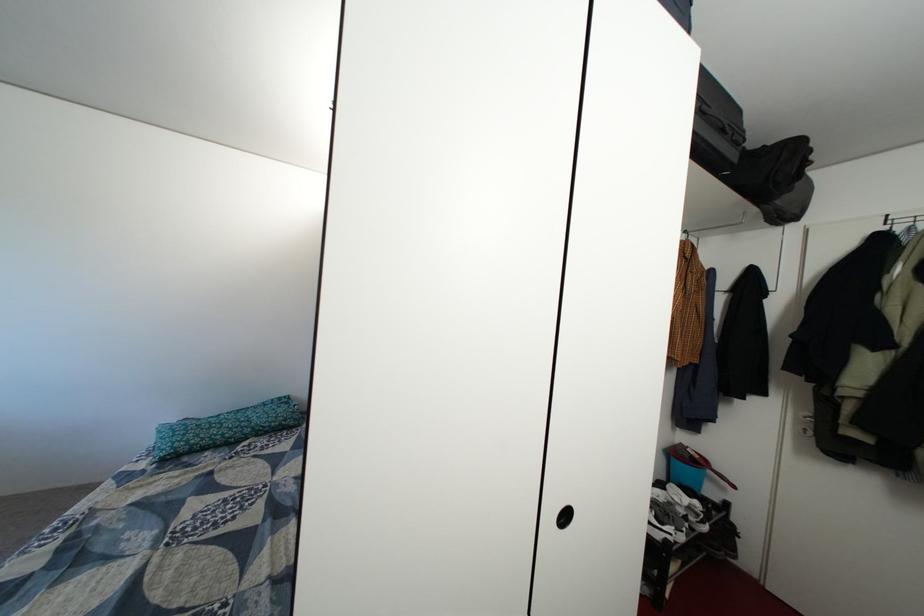
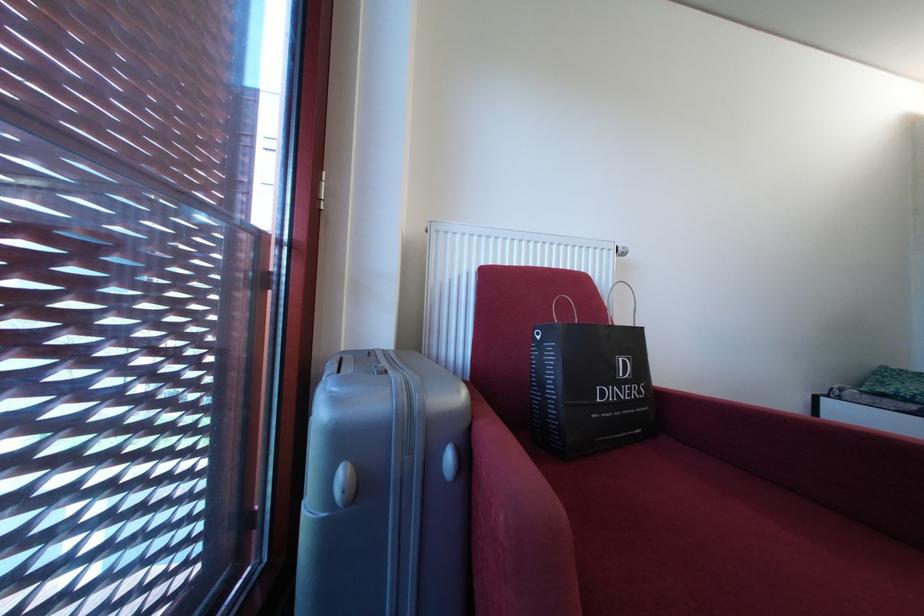
Question: In a continuous first-person perspective shot, in which direction is the camera moving?

Choices:
 (A) Left
 (B) Right
 (C) Forward
 (D) Backward

Answer: (A)